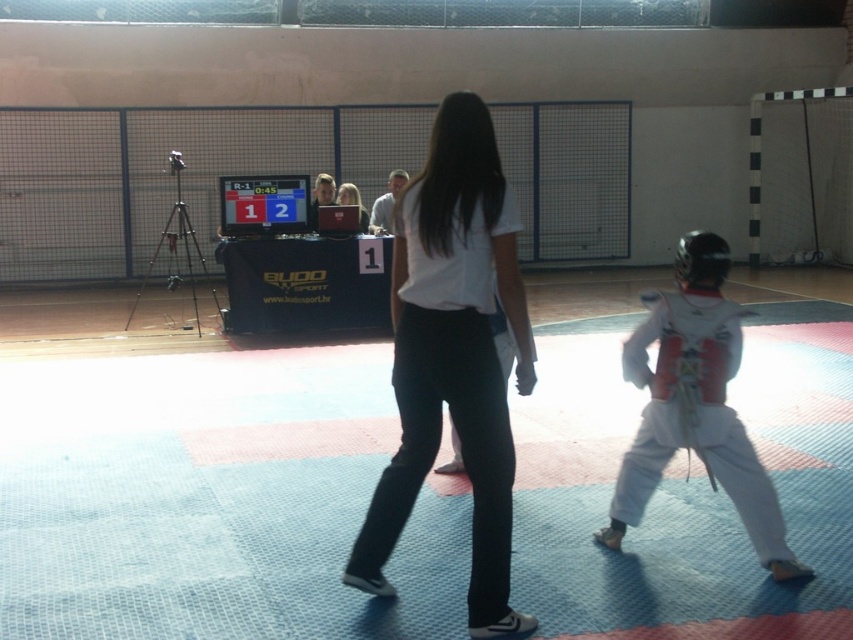
You are a judge in a martial arts competition. You need to determine if the point marked at coordinates [453,356] is on the referee or the competitor. Based on the scene description, which one is it on?

The point marked at coordinates [453,356] is on the white matte shirt at center, which belongs to the referee or coach since the competitor is wearing a white martial arts uniform with a red chest protector and helmet. Therefore, the point is on the referee.

You are a photographer positioned at the back of the competition area. You need to take a photo that includes both the white matte shirt at center and the white karate uniform at right. Considering their sizes, which one might you need to zoom in closer to ensure it appears clearly in the photo?

The white matte shirt at center is thinner than the white karate uniform at right, so you might need to zoom in closer on the white matte shirt at center to ensure it appears clearly in the photo.

You are a photographer positioned at the back of the room. You need to capture a closeup shot of the white karate uniform at right. Given that your camera can focus up to 15 feet, will you be able to take the photo clearly?

The white karate uniform at right is 14.25 feet away from the camera. Since the camera can focus up to 15 feet, you can take the photo clearly as the distance is within the focus range.